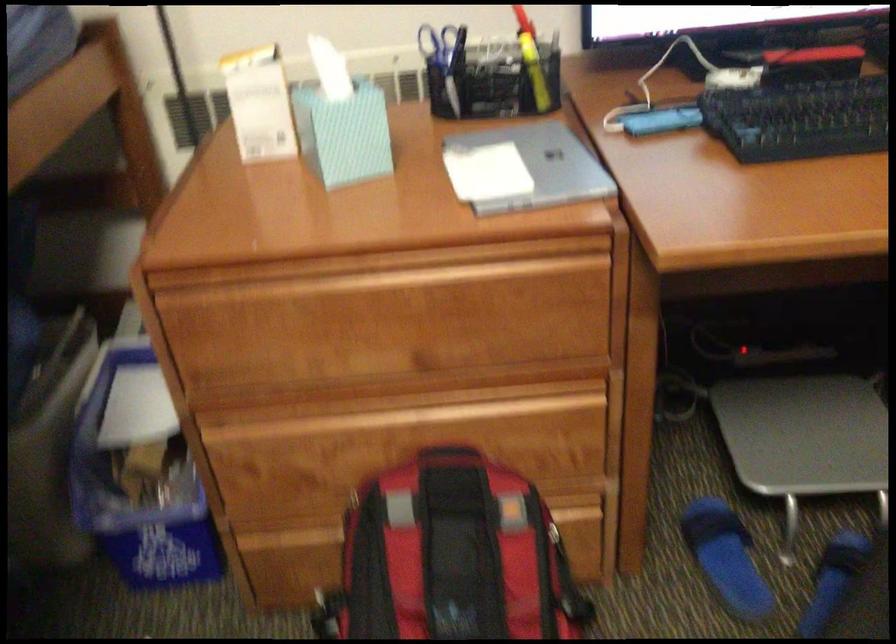
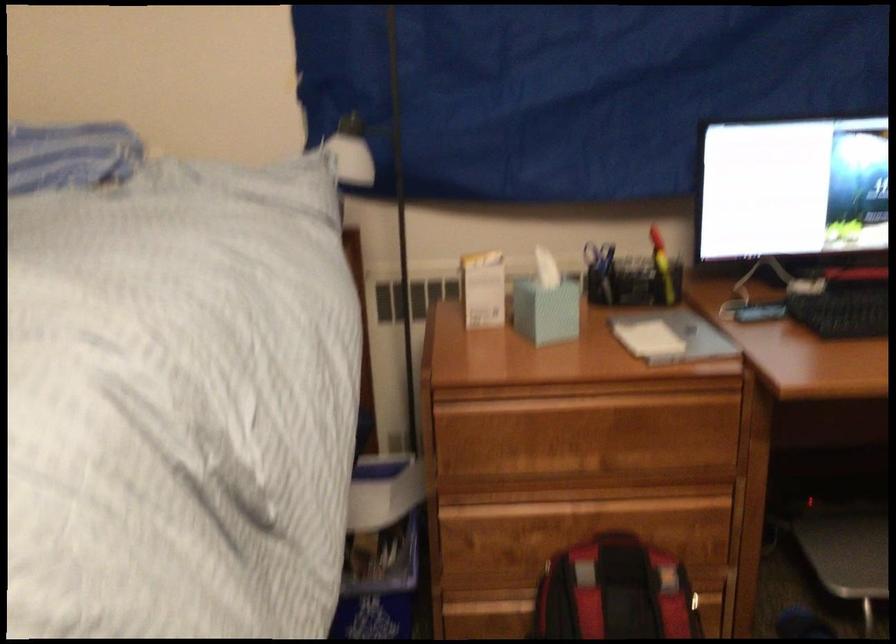
Locate, in the second image, the point that corresponds to [283,536] in the first image.

(478, 601)